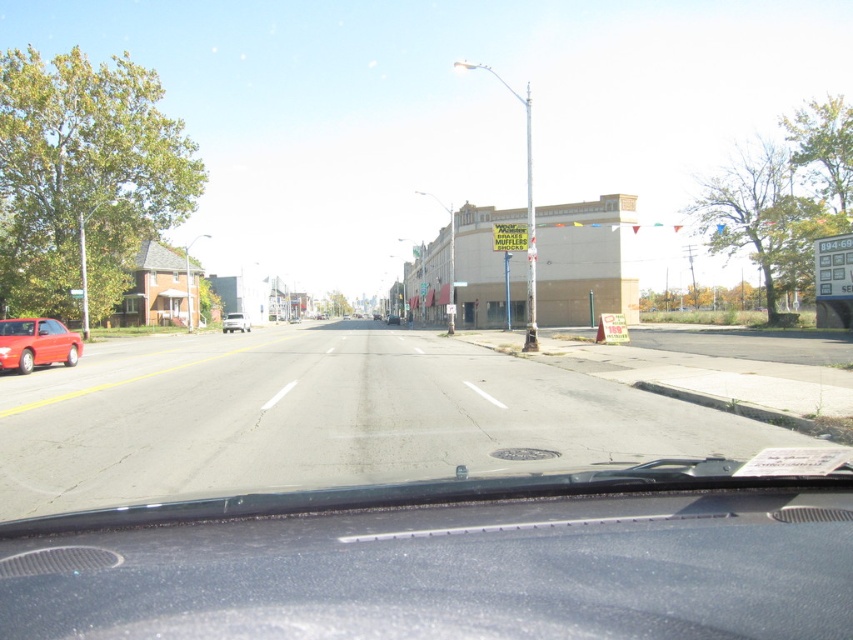
Question: Does black glossy dashboard at center have a greater width compared to matte red car at left?

Choices:
 (A) yes
 (B) no

Answer: (A)

Question: From the image, what is the correct spatial relationship of black glossy dashboard at center in relation to matte red car at left?

Choices:
 (A) below
 (B) above

Answer: (A)

Question: Does black glossy dashboard at center appear on the left side of matte red car at center?

Choices:
 (A) no
 (B) yes

Answer: (A)

Question: Which of the following is the farthest from the observer?

Choices:
 (A) tap(393, 323)
 (B) tap(0, 333)

Answer: (A)

Question: Which object is farther from the camera taking this photo?

Choices:
 (A) black glossy dashboard at center
 (B) matte red car at left

Answer: (B)

Question: Considering the real-world distances, which object is farthest from the matte red car at left?

Choices:
 (A) matte red car at center
 (B) black glossy dashboard at center

Answer: (A)